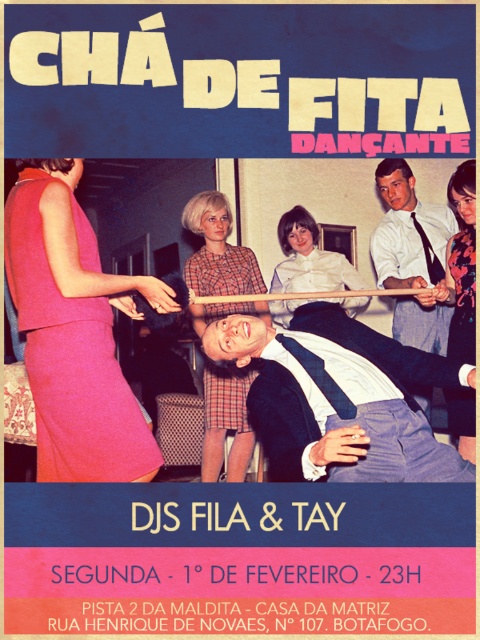
Who is lower down, dark blue suit at center or white shirt at center?

dark blue suit at center is lower down.

Image resolution: width=480 pixels, height=640 pixels. In order to click on dark blue suit at center in this screenshot , I will do `click(315, 381)`.

The height and width of the screenshot is (640, 480). I want to click on dark blue suit at center, so click(x=315, y=381).

Is dark blue suit at center smaller than floral print blouse at upper right?

Actually, dark blue suit at center might be larger than floral print blouse at upper right.

Who is higher up, dark blue suit at center or floral print blouse at upper right?

floral print blouse at upper right is above.

Is point (334, 362) positioned behind point (463, 321)?

No, (334, 362) is closer to viewer.

I want to click on dark blue suit at center, so click(315, 381).

Which is more to the left, plaid fabric skirt at center or white satin blouse at center?

plaid fabric skirt at center is more to the left.

The width and height of the screenshot is (480, 640). What do you see at coordinates (217, 250) in the screenshot?
I see `plaid fabric skirt at center` at bounding box center [217, 250].

The image size is (480, 640). Find the location of `plaid fabric skirt at center`. plaid fabric skirt at center is located at coordinates (217, 250).